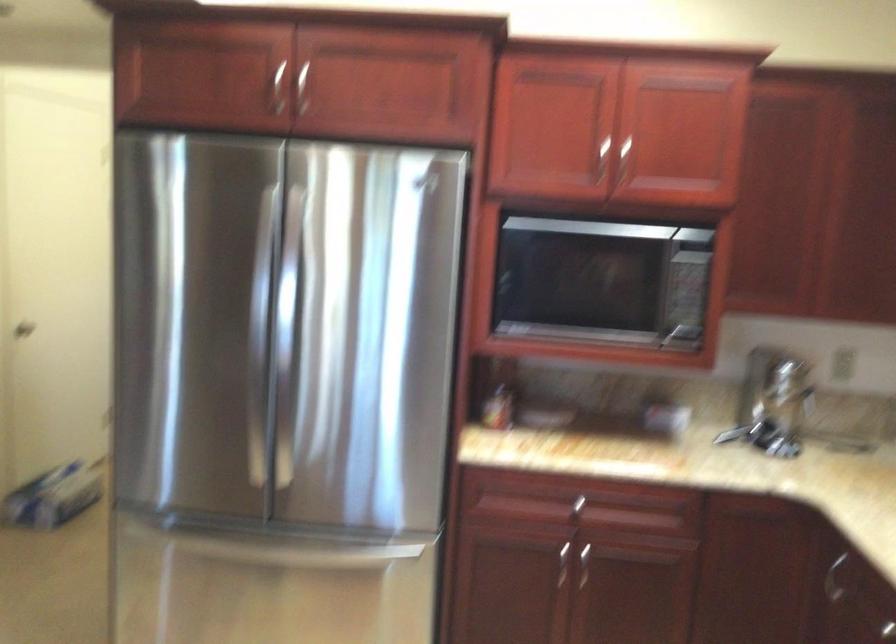
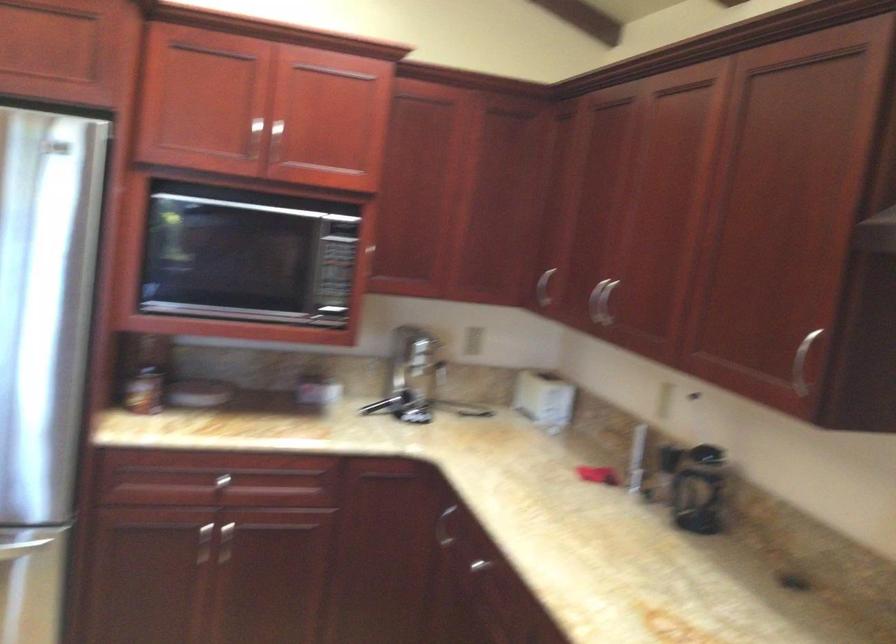
The point at [579,572] is marked in the first image. Where is the corresponding point in the second image?

(222, 543)